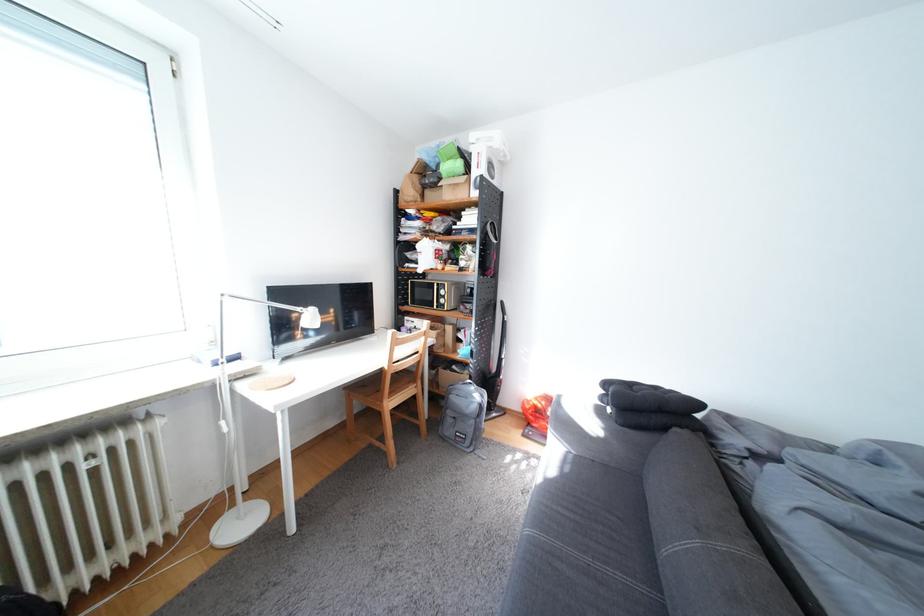
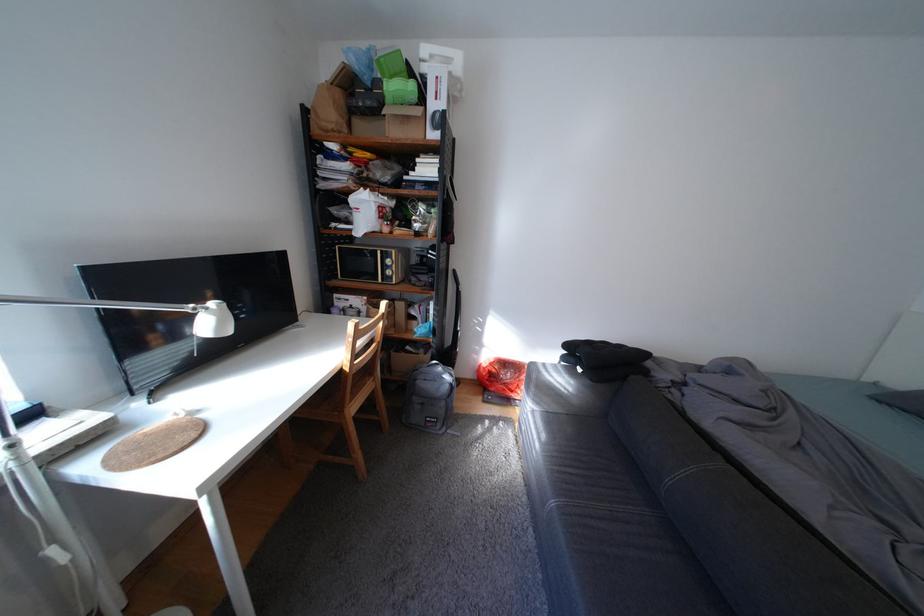
Question: The camera is either moving clockwise (left) or counter-clockwise (right) around the object. The first image is from the beginning of the video and the second image is from the end. Is the camera moving left or right when shooting the video?

Choices:
 (A) Left
 (B) Right

Answer: (A)